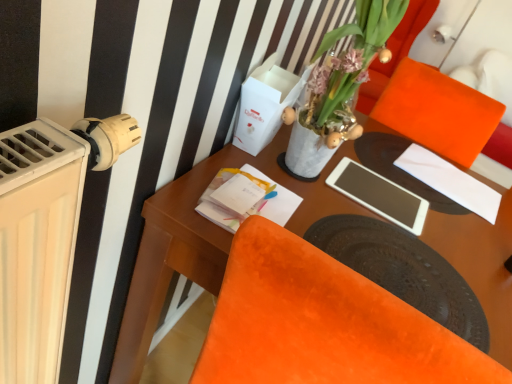
Locate an element on the screen. vacant position to the left of white matte tablet at center is located at coordinates (308, 174).